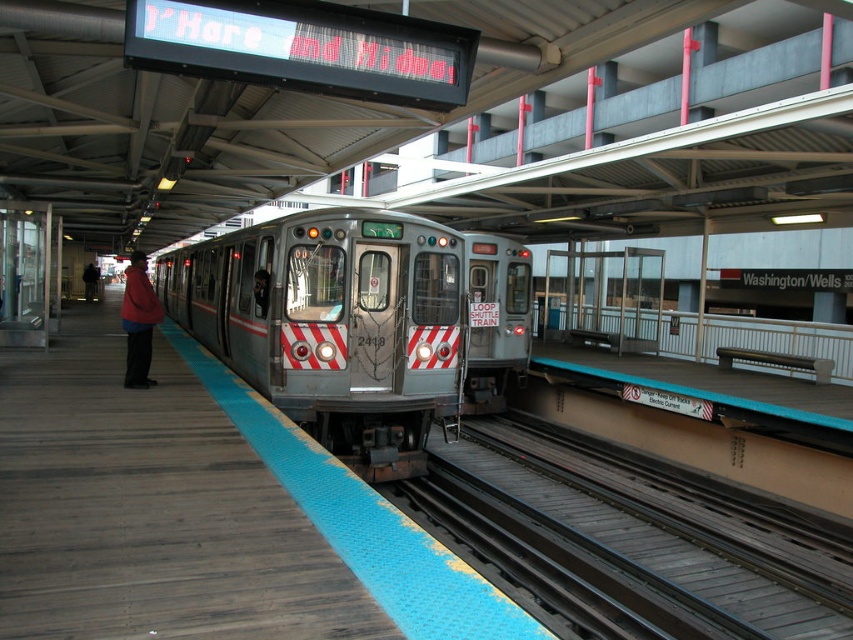
Question: Which point is farther to the camera?

Choices:
 (A) (123, 305)
 (B) (479, 548)

Answer: (A)

Question: Does wooden platform at center lie in front of silver metallic train at center?

Choices:
 (A) no
 (B) yes

Answer: (B)

Question: Is wooden platform at center wider than black metal train track at lower center?

Choices:
 (A) yes
 (B) no

Answer: (A)

Question: Can you confirm if silver metallic train at center is wider than black metal train track at lower center?

Choices:
 (A) yes
 (B) no

Answer: (A)

Question: Which object is the closest to the matte red jacket at left?

Choices:
 (A) black metal train track at lower center
 (B) wooden platform at center

Answer: (B)

Question: Among these objects, which one is nearest to the camera?

Choices:
 (A) black metal train track at lower center
 (B) silver metallic train at center

Answer: (A)